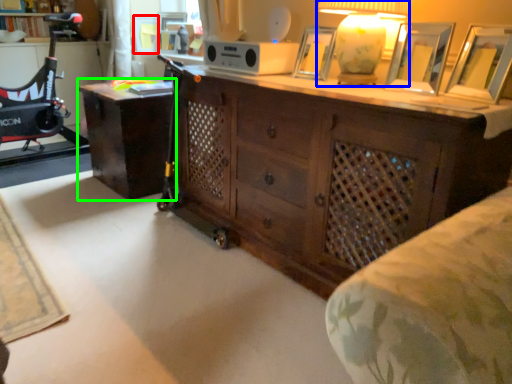
Question: Which object is the farthest from picture frame (highlighted by a red box)? Choose among these: table lamp (highlighted by a blue box) or desk (highlighted by a green box).

Choices:
 (A) table lamp
 (B) desk

Answer: (A)